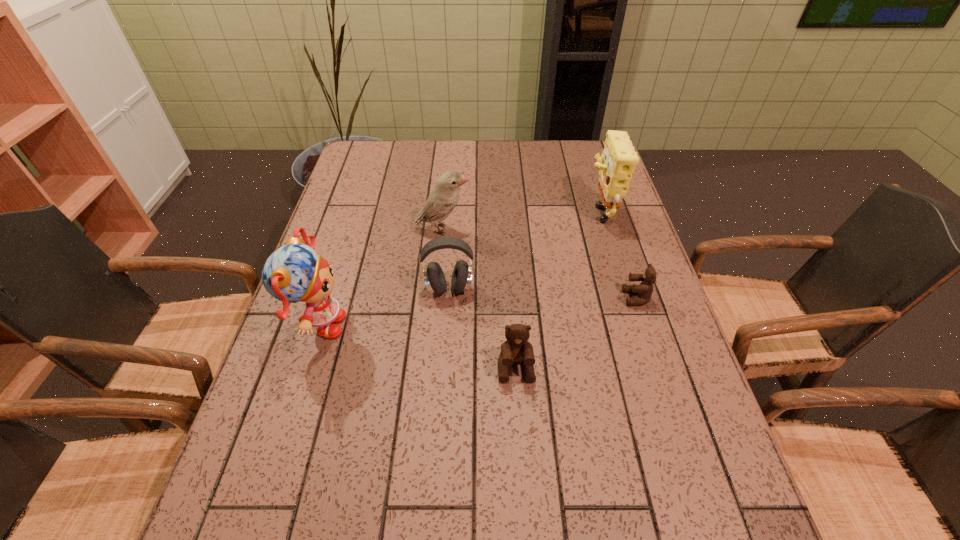
Locate an element on the screen. sponge present at the right edge is located at coordinates (619, 159).

In the image, there is a desktop. Identify the location of blank space at the far edge. The height and width of the screenshot is (540, 960). (476, 150).

This screenshot has height=540, width=960. What are the coordinates of `vacant point at the near edge` in the screenshot? It's located at (486, 474).

Locate an element on the screen. The width and height of the screenshot is (960, 540). vacant area at the left edge is located at coordinates [370, 223].

You are a GUI agent. You are given a task and a screenshot of the screen. Output one action in this format:
    pyautogui.click(x=<x>, y=<y>)
    Task: Click on the vacant space at the right edge of the desktop
    Image resolution: width=960 pixels, height=540 pixels.
    Given the screenshot: What is the action you would take?
    pyautogui.click(x=638, y=322)

In order to click on free location at the far right corner of the desktop in this screenshot , I will do `click(577, 140)`.

Identify the location of free space between the fourth tallest object and the doll. (384, 308).

In order to click on vacant region between the sponge and the farther teddy bear in this screenshot , I will do `click(617, 254)`.

You are a GUI agent. You are given a task and a screenshot of the screen. Output one action in this format:
    pyautogui.click(x=<x>, y=<y>)
    Task: Click on the vacant space that's between the sponge and the taller teddy bear
    This screenshot has height=540, width=960.
    Given the screenshot: What is the action you would take?
    pyautogui.click(x=557, y=289)

Locate an element on the screen. This screenshot has height=540, width=960. free space between the doll and the farther teddy bear is located at coordinates (477, 312).